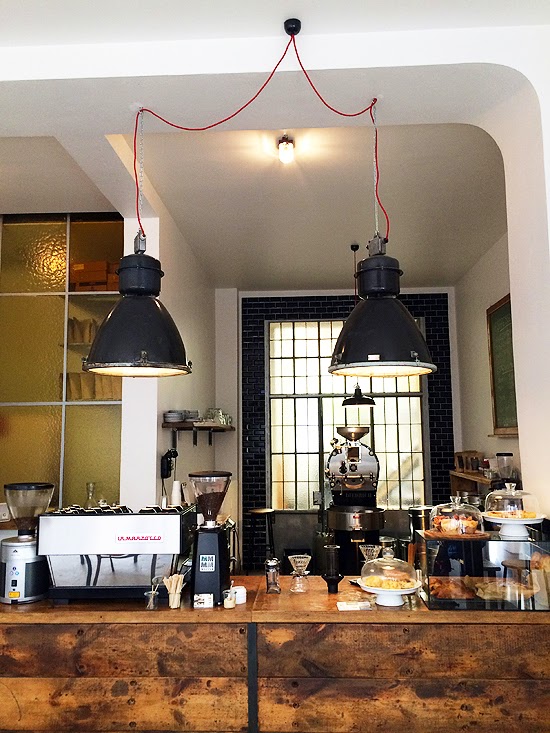
Where is `light`? light is located at coordinates (161, 372), (396, 369).